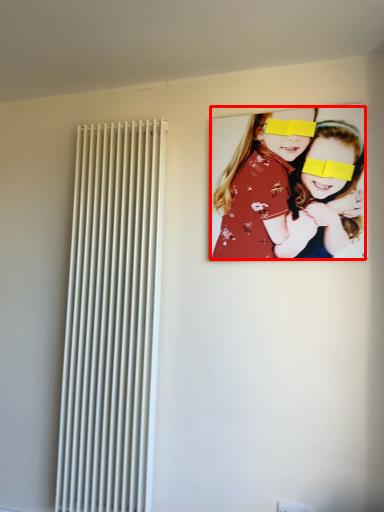
Question: Where is girl (annotated by the red box) located in relation to radiator in the image?

Choices:
 (A) right
 (B) left

Answer: (A)